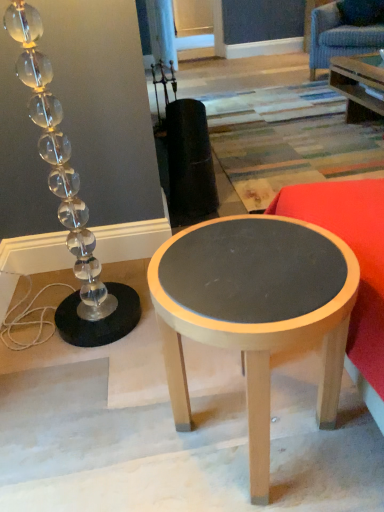
Where is `free space underneath clear glass lamp at left (from a real-world perspective)`? The height and width of the screenshot is (512, 384). free space underneath clear glass lamp at left (from a real-world perspective) is located at coordinates (104, 333).